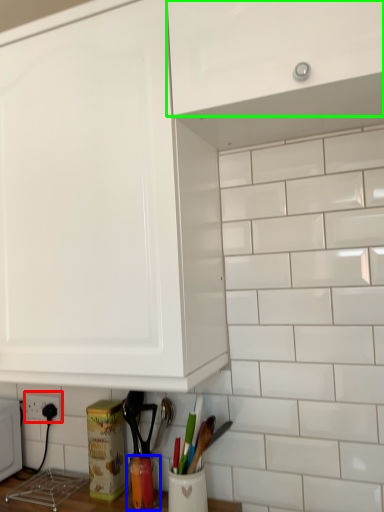
Question: Which is nearer to the electric outlet (highlighted by a red box)? appliance (highlighted by a blue box) or cabinetry (highlighted by a green box).

Choices:
 (A) appliance
 (B) cabinetry

Answer: (A)